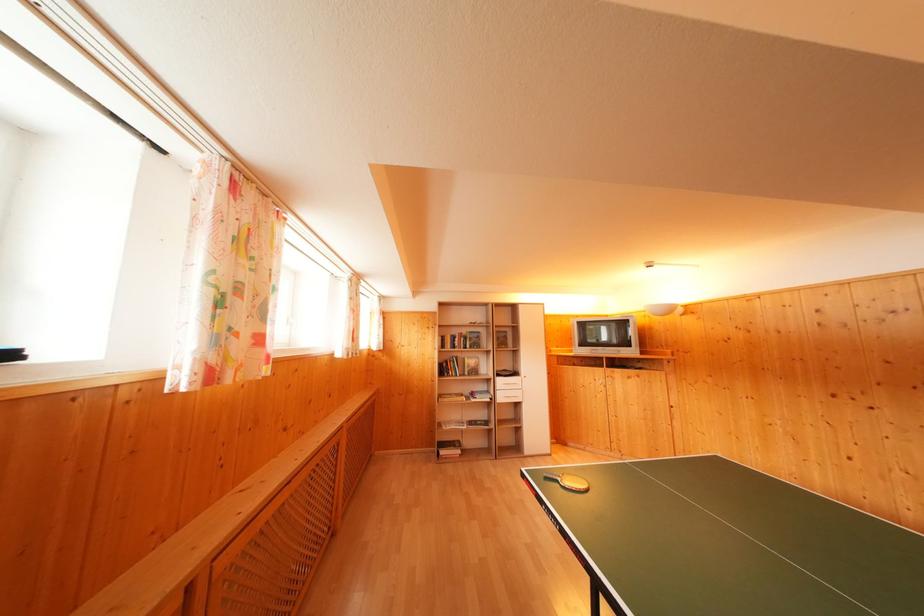
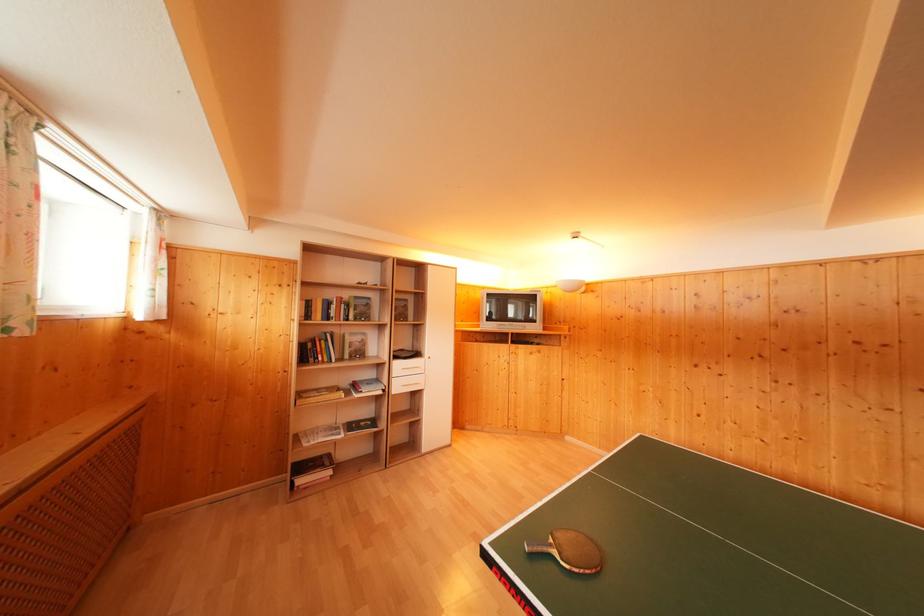
Find the pixel in the second image that matches point (503, 392) in the first image.

(398, 379)